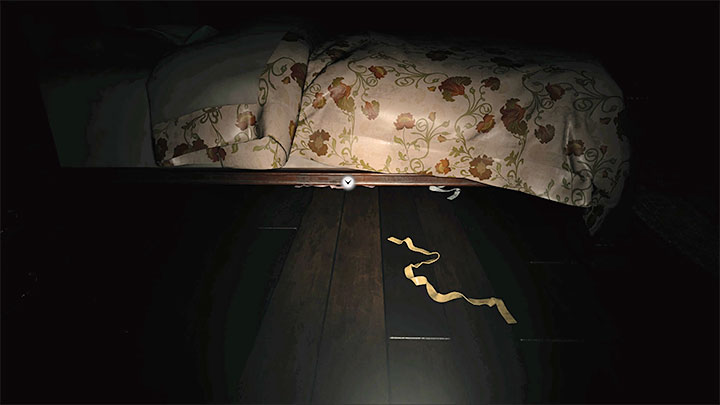
This screenshot has width=720, height=405. I want to click on bed spread, so click(x=384, y=96).